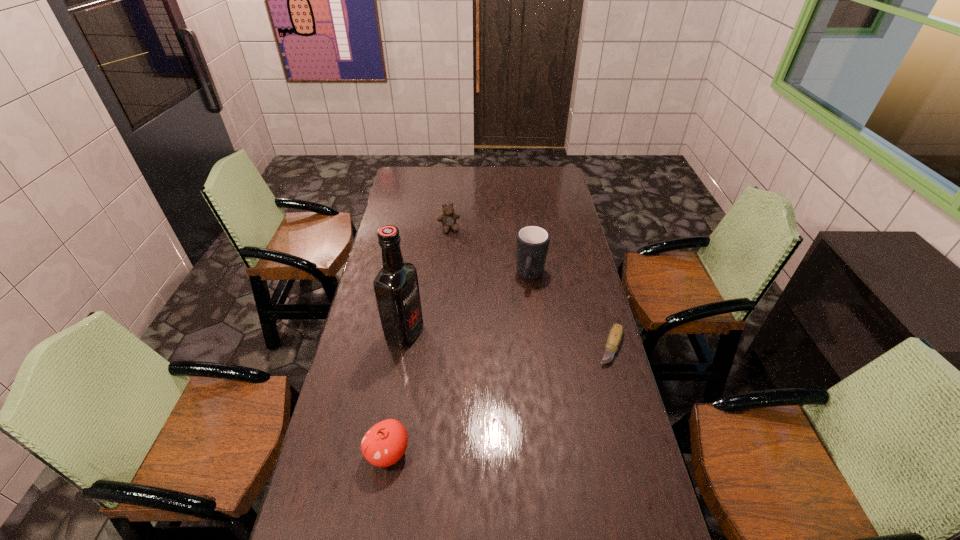
Identify the location of free space that satisfies the following two spatial constraints: 1. on the front side of the shortest object; 2. on the right side of the liquor. (402, 347).

Find the location of a particular element. The height and width of the screenshot is (540, 960). vacant region that satisfies the following two spatial constraints: 1. on the back side of the nearest object; 2. on the left side of the pocketknife is located at coordinates (405, 347).

Locate an element on the screen. This screenshot has height=540, width=960. vacant area that satisfies the following two spatial constraints: 1. on the front side of the liquor; 2. on the left side of the pocketknife is located at coordinates (402, 347).